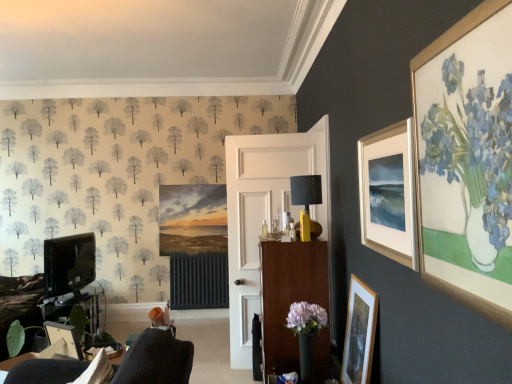
Question: Does matte black tv at left appear on the left side of matte white picture frame at upper right, which is the first picture frame from right to left?

Choices:
 (A) no
 (B) yes

Answer: (B)

Question: From a real-world perspective, is matte black tv at left physically below matte white picture frame at upper right, the 3th picture frame ordered from the bottom?

Choices:
 (A) yes
 (B) no

Answer: (A)

Question: Is matte black tv at left in contact with matte white picture frame at upper right, placed as the third picture frame when sorted from left to right?

Choices:
 (A) yes
 (B) no

Answer: (B)

Question: Would you say matte black tv at left is a long distance from matte white picture frame at upper right, which is the first picture frame from right to left?

Choices:
 (A) no
 (B) yes

Answer: (B)

Question: Is matte black tv at left turned away from matte white picture frame at upper right, placed as the 1th picture frame when sorted from top to bottom?

Choices:
 (A) no
 (B) yes

Answer: (A)

Question: Choose the correct answer: Is wooden cabinet at center inside wooden picture frame at lower left, the first picture frame positioned from the left, or outside it?

Choices:
 (A) outside
 (B) inside

Answer: (A)

Question: In terms of width, does wooden cabinet at center look wider or thinner when compared to wooden picture frame at lower left, the 2th picture frame positioned from the top?

Choices:
 (A) wide
 (B) thin

Answer: (A)

Question: Considering the positions of point (321, 173) and point (70, 329), is point (321, 173) closer or farther from the camera than point (70, 329)?

Choices:
 (A) closer
 (B) farther

Answer: (B)

Question: From their relative heights in the image, would you say wooden cabinet at center is taller or shorter than wooden picture frame at lower left, the first picture frame positioned from the left?

Choices:
 (A) tall
 (B) short

Answer: (A)

Question: From a real-world perspective, relative to brown wood cabinet at center, is wooden cabinet at center vertically above or below?

Choices:
 (A) below
 (B) above

Answer: (B)

Question: Visually, is wooden cabinet at center positioned to the left or to the right of brown wood cabinet at center?

Choices:
 (A) right
 (B) left

Answer: (B)

Question: Is point (251, 165) positioned closer to the camera than point (318, 360)?

Choices:
 (A) closer
 (B) farther

Answer: (B)

Question: In terms of width, does wooden cabinet at center look wider or thinner when compared to brown wood cabinet at center?

Choices:
 (A) wide
 (B) thin

Answer: (B)

Question: Relative to yellow matte lampshade at center, is matte black tv at left in front or behind?

Choices:
 (A) behind
 (B) front

Answer: (A)

Question: Is matte black tv at left bigger or smaller than yellow matte lampshade at center?

Choices:
 (A) small
 (B) big

Answer: (B)